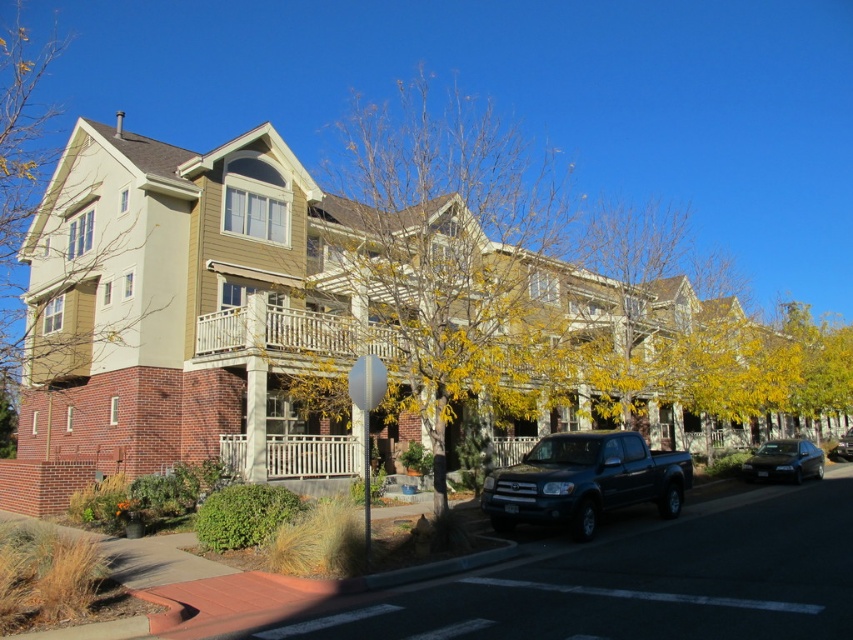
Who is taller, shiny black sedan at lower right or shiny black truck at center?

Standing taller between the two is shiny black sedan at lower right.

Is shiny black sedan at lower right positioned at the back of shiny black truck at center?

No.

Is point (773, 474) closer to camera compared to point (843, 435)?

Yes, point (773, 474) is in front of point (843, 435).

The height and width of the screenshot is (640, 853). What are the coordinates of `shiny black sedan at lower right` in the screenshot? It's located at (784, 460).

Is matte dark blue truck at center in front of white painted wood porch at upper center?

That is True.

Based on the photo, is matte dark blue truck at center to the right of white painted wood porch at upper center from the viewer's perspective?

Correct, you'll find matte dark blue truck at center to the right of white painted wood porch at upper center.

Is point (624, 461) positioned in front of point (283, 337)?

Yes.

The width and height of the screenshot is (853, 640). Find the location of `matte dark blue truck at center`. matte dark blue truck at center is located at coordinates (584, 481).

Who is shorter, matte dark blue truck at center or shiny black sedan at lower right?

Standing shorter between the two is shiny black sedan at lower right.

Can you confirm if matte dark blue truck at center is wider than shiny black sedan at lower right?

Yes, matte dark blue truck at center is wider than shiny black sedan at lower right.

At what (x,y) coordinates should I click in order to perform the action: click on matte dark blue truck at center. Please return your answer as a coordinate pair (x, y). The width and height of the screenshot is (853, 640). Looking at the image, I should click on (584, 481).

Identify the location of matte dark blue truck at center. The width and height of the screenshot is (853, 640). point(584,481).